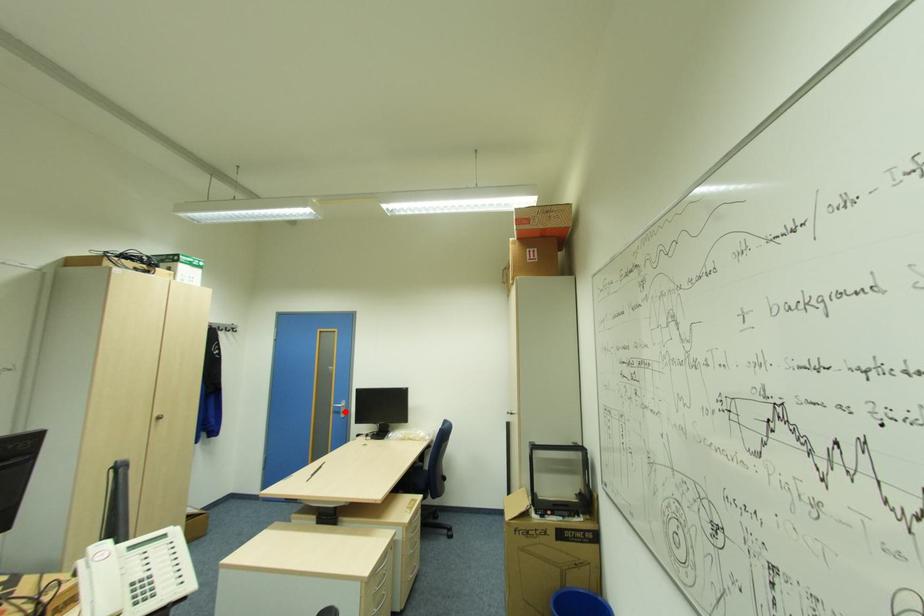
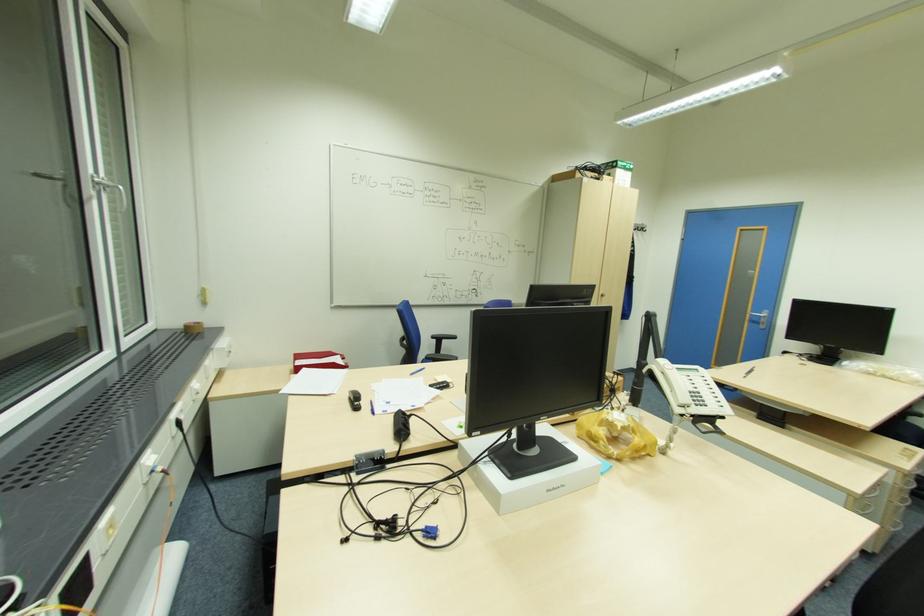
Locate, in the second image, the point that corresponds to the highlighted location in the first image.

(766, 323)